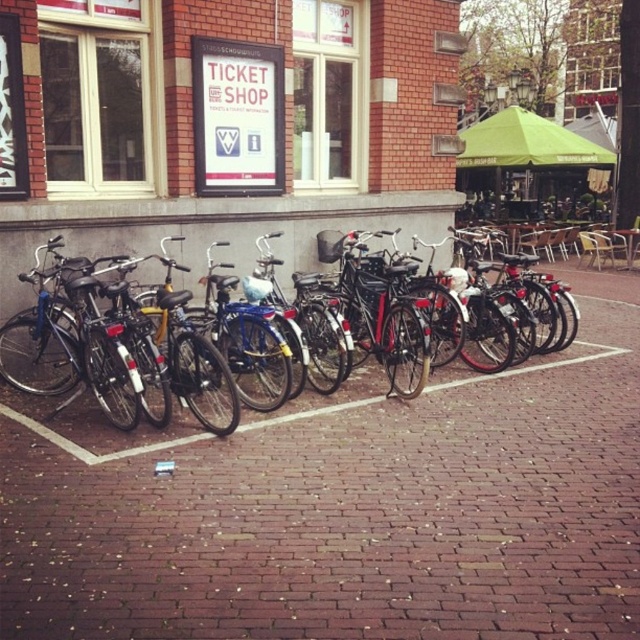
You are a delivery person who needs to place a small box on the ground near the shiny black bicycle at center. Given that the brick pavement at center is the only flat surface available, can you safely place the box there?

The brick pavement at center has a lesser height compared to the shiny black bicycle at center, so yes, the box can be safely placed on the brick pavement at center as it is lower and stable.

You are standing in the street scene and want to know how far the point at coordinates [625,317] is from your current position. Can you determine the distance?

The point at coordinates [625,317] is 11.20 meters away from your current position.

You are standing on the brick pavement at center and want to pick up a shiny black bicycle at center. Can you reach the bicycle without moving from your current position?

The brick pavement at center is below the shiny black bicycle at center, so yes, you can reach the shiny black bicycle at center while standing on the brick pavement at center.